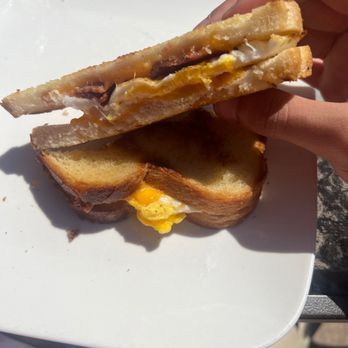
Where is `plate`? This screenshot has height=348, width=348. plate is located at coordinates (188, 288), (37, 32).